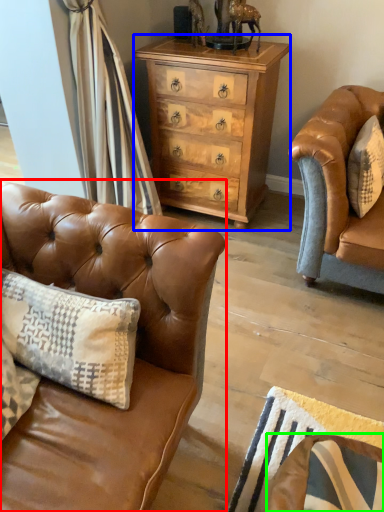
Question: Estimate the real-world distances between objects in this image. Which object is farther from studio couch (highlighted by a red box), chest of drawers (highlighted by a blue box) or swivel chair (highlighted by a green box)?

Choices:
 (A) chest of drawers
 (B) swivel chair

Answer: (A)